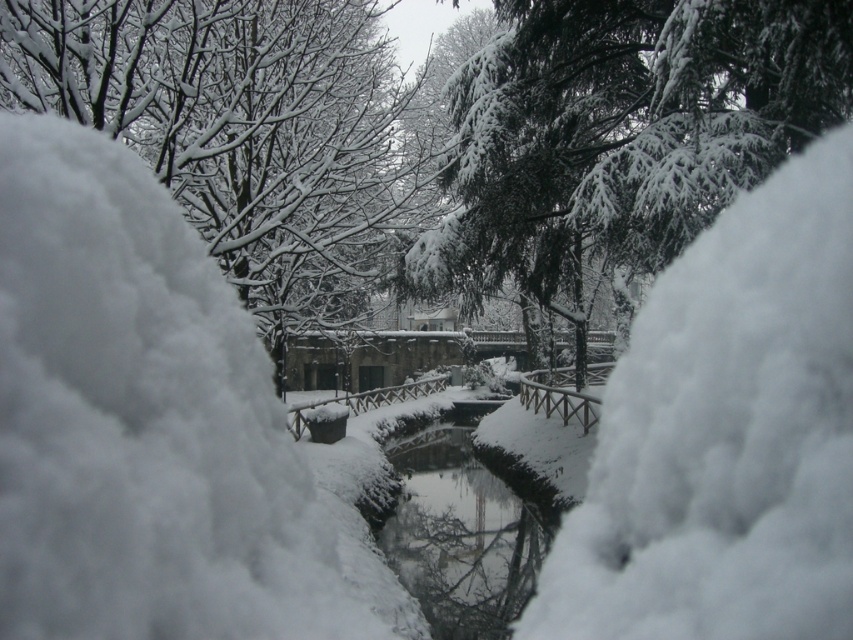
You are standing at the edge of the snow and want to walk towards the stone structure. Which object, the white fluffy snow at center or the smooth ice water at center, will you step on first?

You will step on the white fluffy snow at center first because it is above the smooth ice water at center, meaning it is closer to your current position.

You are standing at the point marked as point (149,428) in the winter scene. What is the terrain like under your feet?

The terrain under your feet at point (149,428) is white fluffy snow at center.

You are standing at the edge of the waterway and want to reach the stone structure beyond the bridge. Which direction should you go relative to the white fluffy snow at center?

To reach the stone structure beyond the bridge, you should go in the direction opposite to the white fluffy snow at center, as the snow is located at the center near the waterway, and the stone structure is beyond the bridge which is further ahead from your current position.